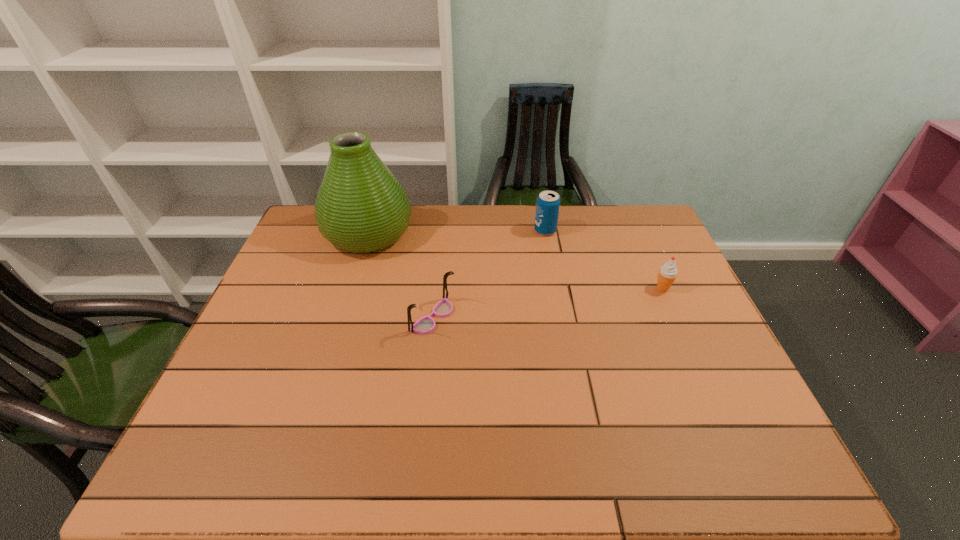
Find the location of a particular element. the tallest object is located at coordinates (361, 207).

The height and width of the screenshot is (540, 960). I want to click on the leftmost object, so click(x=361, y=207).

Where is `soda can`? soda can is located at coordinates (548, 202).

At what (x,y) coordinates should I click in order to perform the action: click on the nearest object. Please return your answer as a coordinate pair (x, y). The image size is (960, 540). Looking at the image, I should click on (425, 325).

This screenshot has height=540, width=960. Identify the location of spectacles. (425, 325).

The height and width of the screenshot is (540, 960). I want to click on the third farthest object, so click(x=667, y=273).

Where is `icecream`? The width and height of the screenshot is (960, 540). icecream is located at coordinates (667, 273).

At what (x,y) coordinates should I click in order to perform the action: click on free space located 0.320m on the front of the vase. Please return your answer as a coordinate pair (x, y). Image resolution: width=960 pixels, height=540 pixels. Looking at the image, I should click on (334, 343).

Where is `blank space located on the front of the second object from right to left`? Image resolution: width=960 pixels, height=540 pixels. blank space located on the front of the second object from right to left is located at coordinates (553, 275).

At what (x,y) coordinates should I click in order to perform the action: click on vacant space situated on the left of the spectacles. Please return your answer as a coordinate pair (x, y). Looking at the image, I should click on (296, 318).